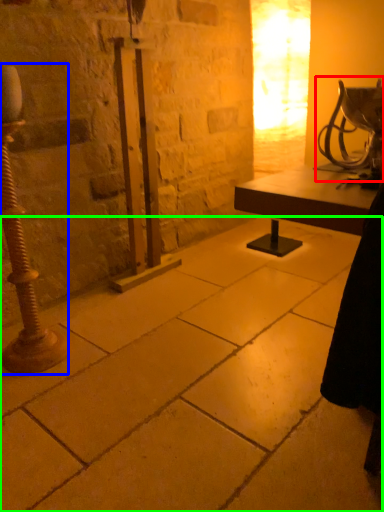
Question: Which object is positioned farthest from table lamp (highlighted by a red box)? Select from pillar (highlighted by a blue box) and concrete (highlighted by a green box).

Choices:
 (A) pillar
 (B) concrete

Answer: (A)